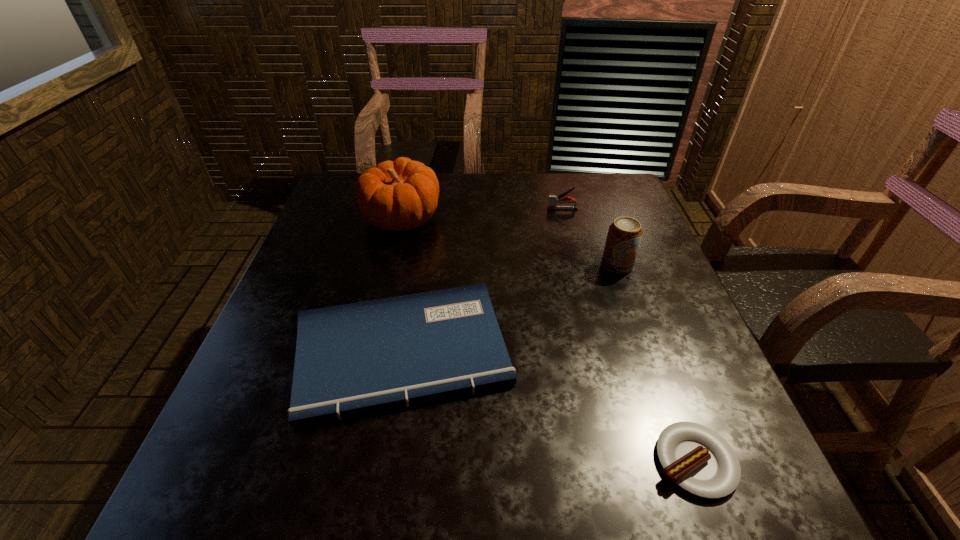
Locate an element on the screen. The width and height of the screenshot is (960, 540). vacant space situated 0.330m on the handle side of the third object from left to right is located at coordinates (433, 209).

You are a GUI agent. You are given a task and a screenshot of the screen. Output one action in this format:
    pyautogui.click(x=<x>, y=<y>)
    Task: Click on the vacant space located on the handle side of the third object from left to right
    
    Given the screenshot: What is the action you would take?
    pyautogui.click(x=527, y=209)

Where is `free space located 0.400m on the back of the paperback book`? free space located 0.400m on the back of the paperback book is located at coordinates (427, 200).

At what (x,y) coordinates should I click in order to perform the action: click on free spot located 0.210m on the back of the sausage. Please return your answer as a coordinate pair (x, y). The width and height of the screenshot is (960, 540). Looking at the image, I should click on (647, 333).

Where is `pumpkin that is at the far edge`? The image size is (960, 540). pumpkin that is at the far edge is located at coordinates (400, 195).

Image resolution: width=960 pixels, height=540 pixels. I want to click on stapler located in the far edge section of the desktop, so tap(553, 200).

The width and height of the screenshot is (960, 540). Find the location of `object present at the near edge`. object present at the near edge is located at coordinates (696, 458).

I want to click on pumpkin present at the left edge, so click(x=400, y=195).

Identify the location of paperback book that is at the left edge. (356, 358).

I want to click on beer can present at the right edge, so click(x=624, y=235).